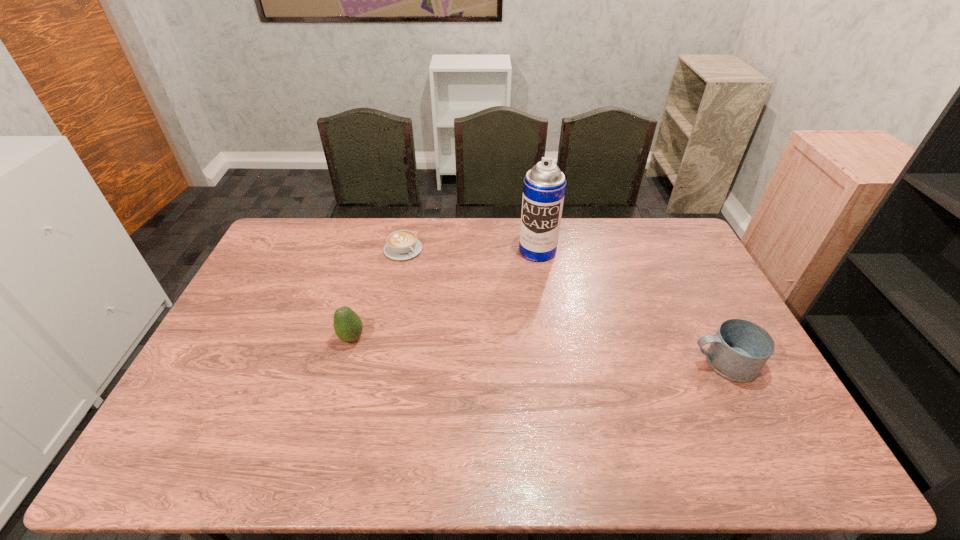
Identify the location of avocado. This screenshot has height=540, width=960. (348, 326).

Where is `the rightmost object`? the rightmost object is located at coordinates (740, 349).

The height and width of the screenshot is (540, 960). Find the location of `the tallest object`. the tallest object is located at coordinates (544, 186).

Where is `the second object from right to left`? the second object from right to left is located at coordinates pos(544,186).

In order to click on the shortest object in this screenshot , I will do `click(403, 244)`.

Identify the location of vacant space located 0.080m on the back of the avocado. Image resolution: width=960 pixels, height=540 pixels. (360, 308).

Where is `free space located 0.390m on the side of the mug with the handle`? This screenshot has width=960, height=540. free space located 0.390m on the side of the mug with the handle is located at coordinates (553, 362).

Find the location of `vacant space positioned 0.110m on the side of the mug with the handle`. vacant space positioned 0.110m on the side of the mug with the handle is located at coordinates (652, 362).

You are a GUI agent. You are given a task and a screenshot of the screen. Output one action in this format:
    pyautogui.click(x=<x>, y=<y>)
    Task: Click on the free region located on the side of the mug with the handle
    The height and width of the screenshot is (540, 960).
    Given the screenshot: What is the action you would take?
    pyautogui.click(x=561, y=362)

You are a GUI agent. You are given a task and a screenshot of the screen. Output one action in this format:
    pyautogui.click(x=<x>, y=<y>)
    Task: Click on the vacant space located 0.400m on the label side of the tallest object
    This screenshot has width=960, height=540.
    Given the screenshot: What is the action you would take?
    (505, 346)